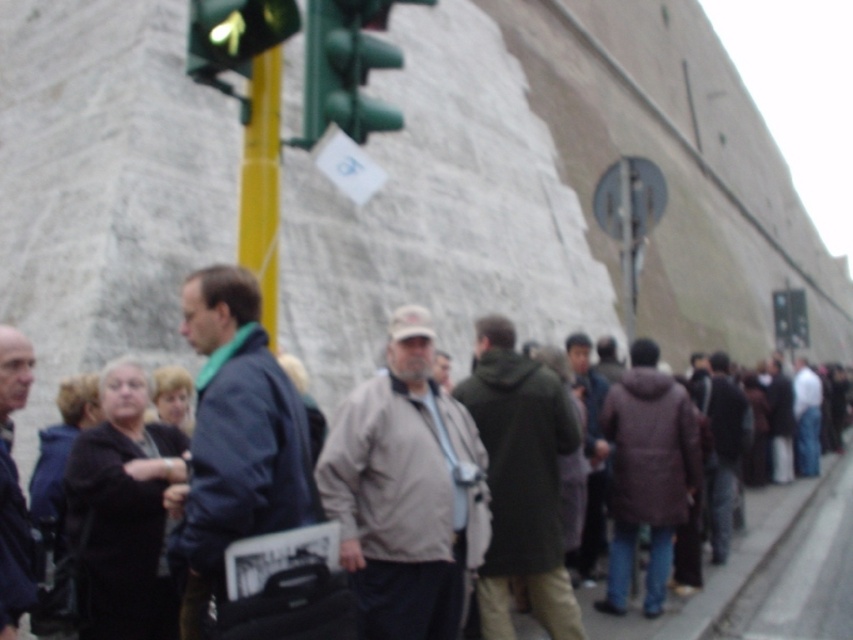
You are a delivery person carrying a large box that measures 2 meters in length. You need to walk through the space between the dark blue jacket at center and the metallic yellow pole at upper left. Is there enough space for you to pass through without touching either object?

The distance between the dark blue jacket at center and the metallic yellow pole at upper left is 3.06 meters. Since the box is 2 meters long, there is sufficient space to pass through without touching either object.

You are a photographer standing at the edge of the sidewalk. You want to capture a photo that includes both the dark blue jacket at center and the green matte traffic light at upper center. Which object will appear wider in the photo?

The green matte traffic light at upper center will appear wider in the photo because it has a greater width compared to the dark blue jacket at center.